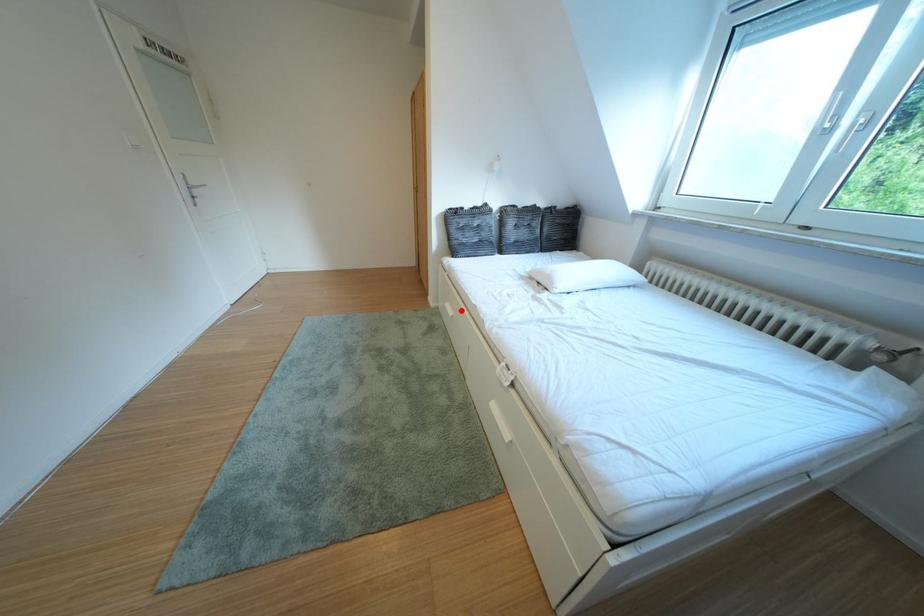
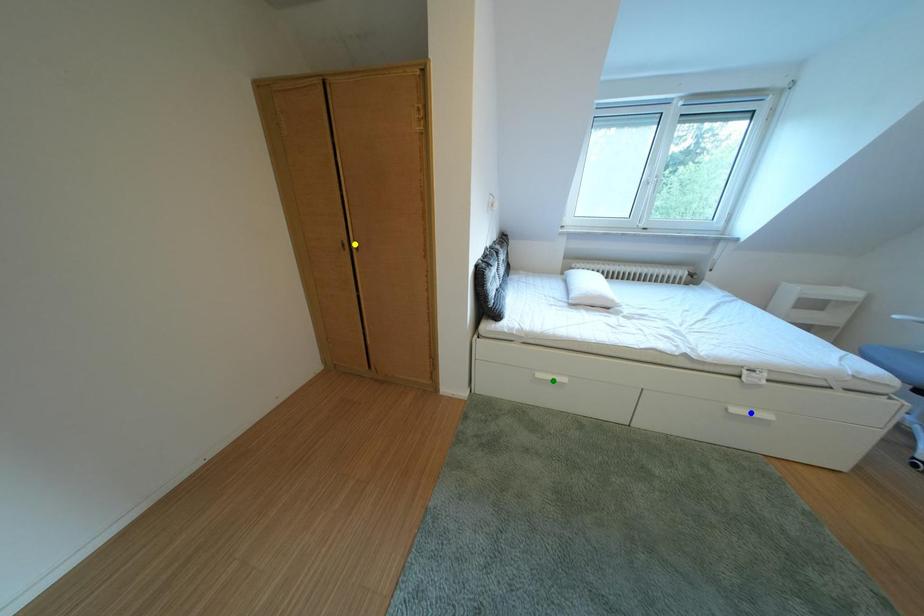
Question: I am providing you with two images of the same scene from different viewpoints. A red point is marked on the first image. You are given multiple points on the second image. Which point in image 2 represents the same 3d spot as the red point in image 1?

Choices:
 (A) green point
 (B) blue point
 (C) yellow point

Answer: (A)